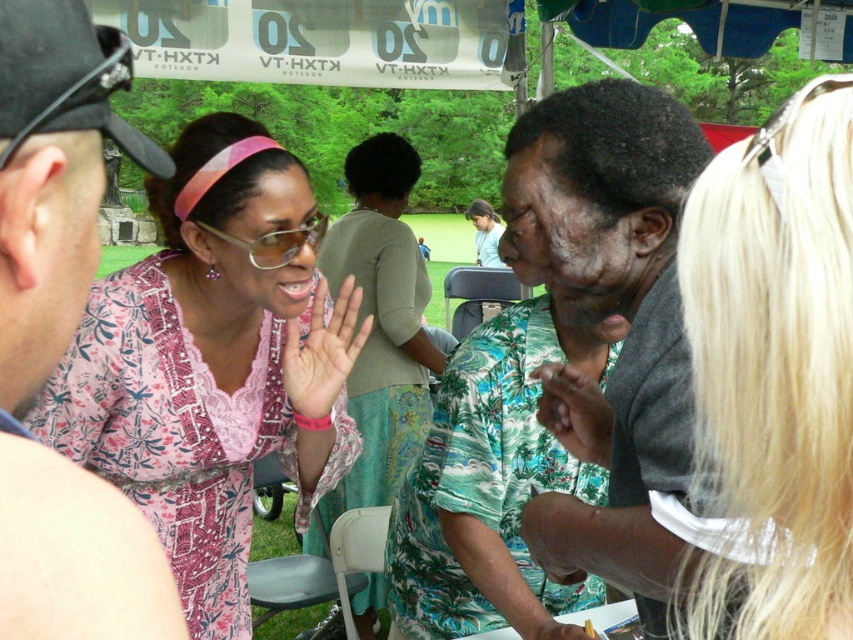
Question: Is blonde hair at upper right to the left of pink lace dress at center from the viewer's perspective?

Choices:
 (A) no
 (B) yes

Answer: (A)

Question: Considering the real-world distances, which object is farthest from the pink floral dress at center?

Choices:
 (A) pink floral shirt at upper left
 (B) pink lace dress at center

Answer: (B)

Question: Does green floral shirt at center appear under pink floral shirt at upper left?

Choices:
 (A) yes
 (B) no

Answer: (A)

Question: Which of the following is the closest to the observer?

Choices:
 (A) pink lace dress at center
 (B) pink floral shirt at upper left
 (C) green floral shirt at center
 (D) blonde hair at upper right

Answer: (B)

Question: Which is farther from the green floral shirt at center?

Choices:
 (A) pink floral shirt at upper left
 (B) pink lace dress at center
 (C) pink floral dress at center
 (D) blonde hair at upper right

Answer: (B)

Question: Can you confirm if pink floral dress at center is smaller than blonde hair at upper right?

Choices:
 (A) no
 (B) yes

Answer: (A)